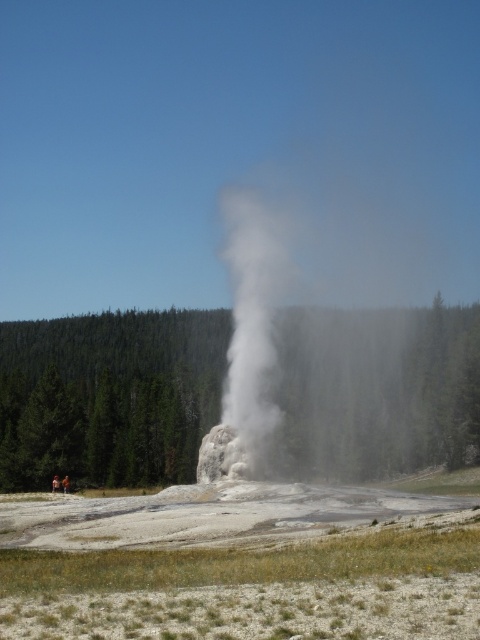
Question: Which of the following is the closest to the observer?

Choices:
 (A) white vapor at center
 (B) green textured tree at center

Answer: (A)

Question: Where is green textured tree at center located in relation to white vapor at center in the image?

Choices:
 (A) left
 (B) right

Answer: (A)

Question: Can you confirm if green textured tree at center is smaller than white vapor at center?

Choices:
 (A) yes
 (B) no

Answer: (A)

Question: Considering the relative positions of green textured tree at center and white vapor at center in the image provided, where is green textured tree at center located with respect to white vapor at center?

Choices:
 (A) right
 (B) left

Answer: (B)